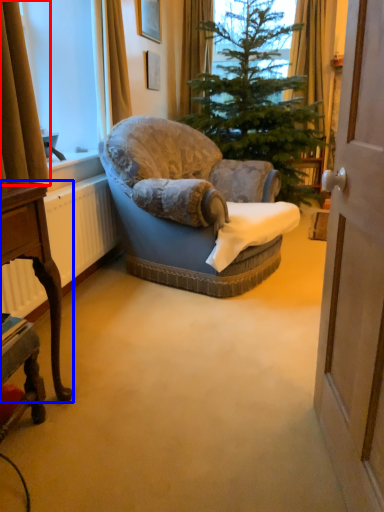
Question: Among these objects, which one is farthest to the camera, curtain (highlighted by a red box) or desk (highlighted by a blue box)?

Choices:
 (A) curtain
 (B) desk

Answer: (A)